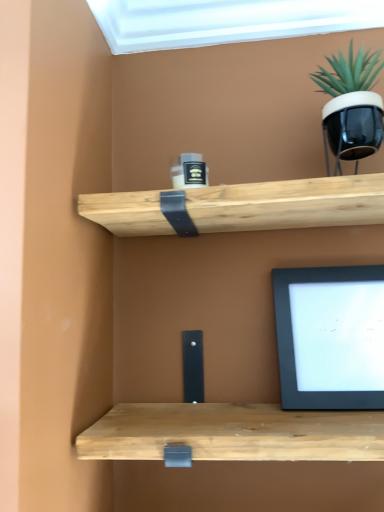
What do you see at coordinates (330, 337) in the screenshot?
I see `black matte computer monitor at lower right` at bounding box center [330, 337].

I want to click on black matte computer monitor at lower right, so click(x=330, y=337).

What do you see at coordinates (351, 106) in the screenshot?
I see `black glossy pot at upper right` at bounding box center [351, 106].

You are a GUI agent. You are given a task and a screenshot of the screen. Output one action in this format:
    pyautogui.click(x=<x>, y=<y>)
    Task: Click on the black glossy pot at upper right
    Image resolution: width=384 pixels, height=512 pixels.
    Given the screenshot: What is the action you would take?
    pyautogui.click(x=351, y=106)

Measure the distance between black glossy pot at upper right and camera.

The depth of black glossy pot at upper right is 28.40 inches.

I want to click on black matte computer monitor at lower right, so [x=330, y=337].

Which object is positioned more to the right, black matte computer monitor at lower right or black glossy pot at upper right?

From the viewer's perspective, black glossy pot at upper right appears more on the right side.

Which is in front, black matte computer monitor at lower right or black glossy pot at upper right?

Positioned in front is black glossy pot at upper right.

Which is in front, point (304, 369) or point (354, 101)?

The point (354, 101) is in front.

From the image's perspective, relative to black glossy pot at upper right, is black matte computer monitor at lower right above or below?

Based on their image positions, black matte computer monitor at lower right is located beneath black glossy pot at upper right.

From a real-world perspective, is black matte computer monitor at lower right above or below black glossy pot at upper right?

From a real-world perspective, black matte computer monitor at lower right is physically below black glossy pot at upper right.

Is black matte computer monitor at lower right thinner than black glossy pot at upper right?

Indeed, black matte computer monitor at lower right has a lesser width compared to black glossy pot at upper right.

Which of these two, black matte computer monitor at lower right or black glossy pot at upper right, stands taller?

black matte computer monitor at lower right is taller.

Can you confirm if black matte computer monitor at lower right is bigger than black glossy pot at upper right?

Incorrect, black matte computer monitor at lower right is not larger than black glossy pot at upper right.

Is black glossy pot at upper right located within black matte computer monitor at lower right?

No, black glossy pot at upper right is located outside of black matte computer monitor at lower right.

In the scene shown: Is black matte computer monitor at lower right not close to black glossy pot at upper right?

Actually, black matte computer monitor at lower right and black glossy pot at upper right are a little close together.

Is black matte computer monitor at lower right aimed at black glossy pot at upper right?

No, black matte computer monitor at lower right is not facing towards black glossy pot at upper right.

You are a GUI agent. You are given a task and a screenshot of the screen. Output one action in this format:
    pyautogui.click(x=<x>, y=<y>)
    Task: Click on the houseplant in front of the black matte computer monitor at lower right
    This screenshot has height=512, width=384.
    Given the screenshot: What is the action you would take?
    pyautogui.click(x=351, y=106)

In the image, is black glossy pot at upper right on the left side or the right side of black matte computer monitor at lower right?

From the image, it's evident that black glossy pot at upper right is to the right of black matte computer monitor at lower right.

Is the position of black glossy pot at upper right more distant than that of black matte computer monitor at lower right?

No, black glossy pot at upper right is in front of black matte computer monitor at lower right.

Which is farther, [357,122] or [330,275]?

The point [330,275] is more distant.

From the image's perspective, is black glossy pot at upper right under black matte computer monitor at lower right?

A: No.

In the scene shown: From a real-world perspective, which is physically below, black glossy pot at upper right or black matte computer monitor at lower right?

In real-world perspective, black matte computer monitor at lower right is lower.

In terms of width, does black glossy pot at upper right look wider or thinner when compared to black matte computer monitor at lower right?

Considering their sizes, black glossy pot at upper right looks broader than black matte computer monitor at lower right.

Considering the sizes of objects black glossy pot at upper right and black matte computer monitor at lower right in the image provided, who is taller, black glossy pot at upper right or black matte computer monitor at lower right?

black matte computer monitor at lower right.

Does black glossy pot at upper right have a smaller size compared to black matte computer monitor at lower right?

No, black glossy pot at upper right is not smaller than black matte computer monitor at lower right.

Is black matte computer monitor at lower right completely or partially inside black glossy pot at upper right?

No, black matte computer monitor at lower right is not a part of black glossy pot at upper right.

Can you see black glossy pot at upper right touching black matte computer monitor at lower right?

No, black glossy pot at upper right is not with black matte computer monitor at lower right.

Is black glossy pot at upper right oriented towards black matte computer monitor at lower right?

No.

Where is `computer monitor located on the left of black glossy pot at upper right`? computer monitor located on the left of black glossy pot at upper right is located at coordinates (330, 337).

Locate an element on the screen. The height and width of the screenshot is (512, 384). computer monitor below the black glossy pot at upper right (from a real-world perspective) is located at coordinates (330, 337).

Where is `computer monitor behind the black glossy pot at upper right`? computer monitor behind the black glossy pot at upper right is located at coordinates (330, 337).